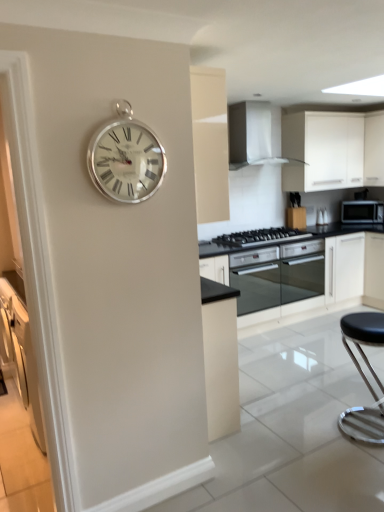
Question: From their relative heights in the image, would you say black glass gas stove at center is taller or shorter than black glass oven at center, placed as the first oven when sorted from left to right?

Choices:
 (A) tall
 (B) short

Answer: (B)

Question: Is black glass gas stove at center wider or thinner than black glass oven at center, placed as the first oven when sorted from left to right?

Choices:
 (A) thin
 (B) wide

Answer: (A)

Question: Which object is positioned farthest from the black glass gas stove at center?

Choices:
 (A) black leather stool at lower right
 (B) black matte microwave at right
 (C) white glossy range hood at upper center
 (D) silver metallic clock at upper left
 (E) white matte cabinet at upper right

Answer: (D)

Question: Estimate the real-world distances between objects in this image. Which object is farther from the black leather stool at lower right?

Choices:
 (A) silver metallic clock at upper left
 (B) white matte cabinet at upper right
 (C) white glossy range hood at upper center
 (D) black glass oven at center, the second oven viewed from the right
 (E) black matte microwave at right

Answer: (B)